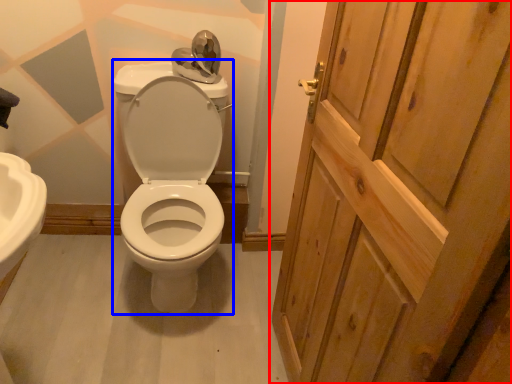
Question: Which object is further to the camera taking this photo, door (highlighted by a red box) or porcelain (highlighted by a blue box)?

Choices:
 (A) door
 (B) porcelain

Answer: (B)